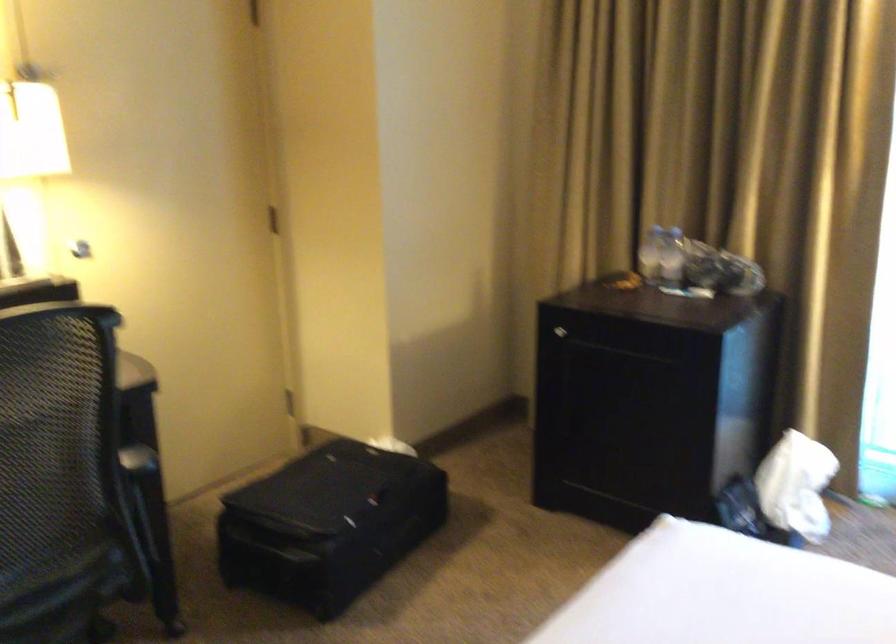
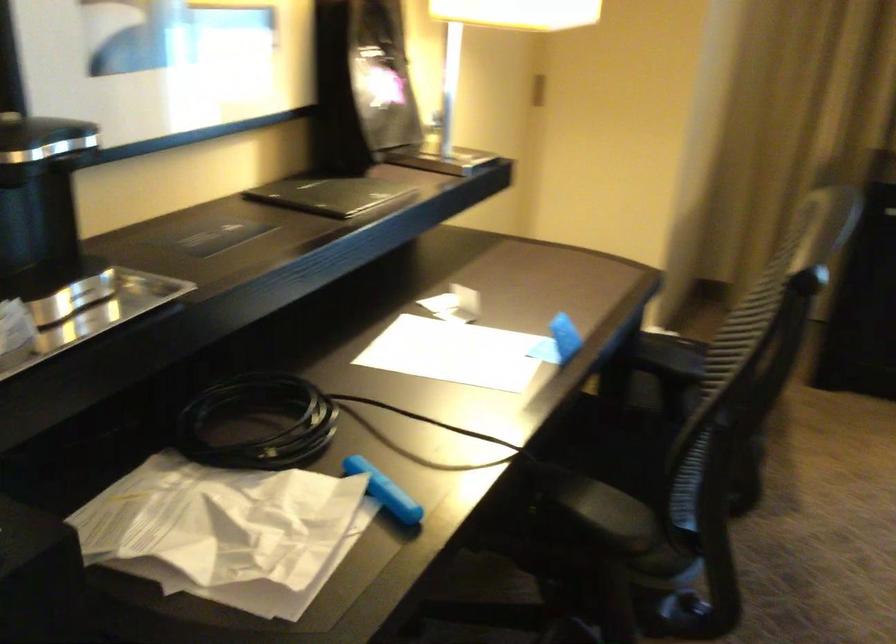
Question: I am providing you with two images of the same scene from different viewpoints. After the viewpoint changes to image2, which objects are now occluded?

Choices:
 (A) black menu book
 (B) red cutter handle
 (C) black suitcase
 (D) chair sitting surface

Answer: (C)